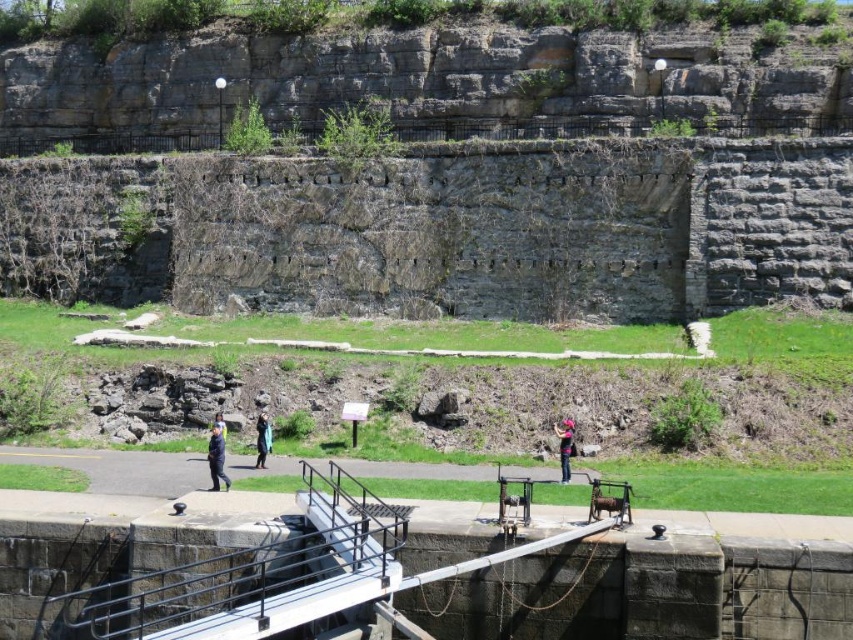
Question: Which point is closer to the camera?

Choices:
 (A) (263, 456)
 (B) (560, 449)
 (C) (216, 435)

Answer: (C)

Question: In this image, where is pink fabric at lower center located relative to blue denim jacket at center?

Choices:
 (A) left
 (B) right

Answer: (B)

Question: Estimate the real-world distances between objects in this image. Which object is farther from the pink fabric at lower center?

Choices:
 (A) blue fabric jacket at lower left
 (B) blue denim jacket at center

Answer: (A)

Question: Can you confirm if pink fabric at lower center is positioned above blue denim jacket at center?

Choices:
 (A) no
 (B) yes

Answer: (A)

Question: Which point is farther to the camera?

Choices:
 (A) (209, 442)
 (B) (267, 445)

Answer: (A)

Question: Is pink fabric at lower center above blue denim jacket at center?

Choices:
 (A) no
 (B) yes

Answer: (A)